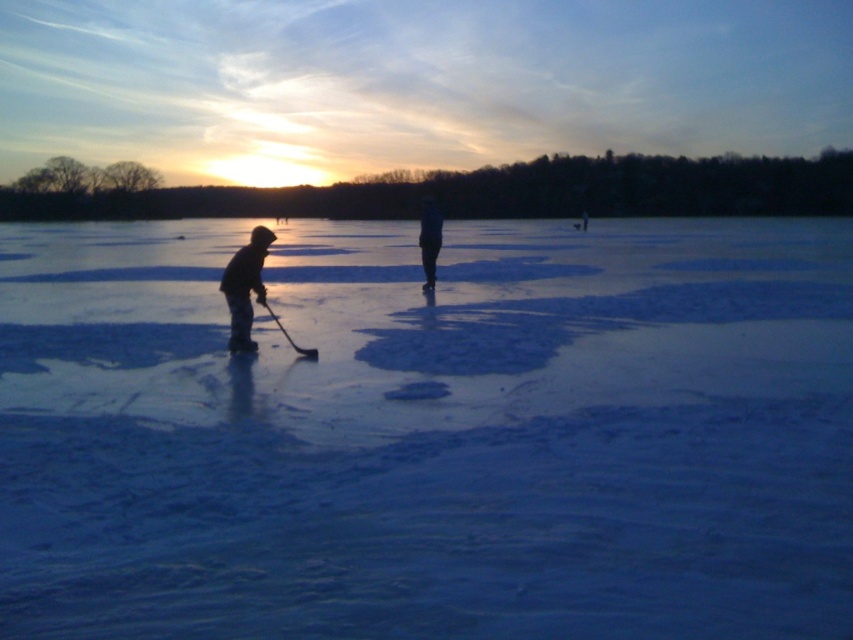
Question: Which point appears farthest from the camera in this image?

Choices:
 (A) (566, 504)
 (B) (235, 298)

Answer: (B)

Question: Where is dark blue jeans at center located in relation to shiny black hockey stick at center in the image?

Choices:
 (A) above
 (B) below

Answer: (A)

Question: Which point appears closest to the camera in this image?

Choices:
 (A) (289, 337)
 (B) (422, 262)
 (C) (259, 276)

Answer: (C)

Question: Is silhouette hockey stick at left positioned before shiny black hockey stick at center?

Choices:
 (A) no
 (B) yes

Answer: (A)

Question: Is white matte ice at center bigger than silhouette hockey stick at left?

Choices:
 (A) no
 (B) yes

Answer: (B)

Question: Which is nearer to the white matte ice at center?

Choices:
 (A) dark blue jeans at center
 (B) silhouette hockey stick at left
 (C) shiny black hockey stick at center

Answer: (B)